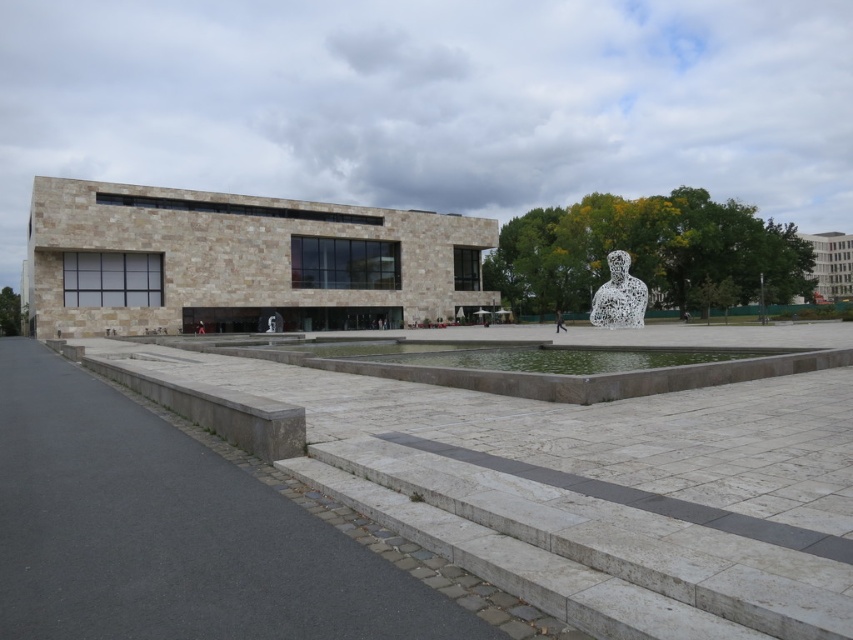
Does beige stone plaza at center appear under speckled stone bust at center-right?

Actually, beige stone plaza at center is above speckled stone bust at center-right.

Which of these two, beige stone plaza at center or speckled stone bust at center-right, stands taller?

beige stone plaza at center

Is point (166, 304) behind point (610, 269)?

Yes, it is.

Locate an element on the screen. The height and width of the screenshot is (640, 853). beige stone plaza at center is located at coordinates (241, 260).

Between point (653, 385) and point (614, 304), which one is positioned in front?

Point (653, 385)

Is point (683, 380) closer to camera compared to point (621, 250)?

Yes, point (683, 380) is in front of point (621, 250).

Locate an element on the screen. The image size is (853, 640). clear stone water at center is located at coordinates (596, 374).

Locate an element on the screen. This screenshot has height=640, width=853. clear stone water at center is located at coordinates (596, 374).

Does beige stone plaza at center have a smaller size compared to clear stone water at center?

Actually, beige stone plaza at center might be larger than clear stone water at center.

The width and height of the screenshot is (853, 640). In order to click on beige stone plaza at center in this screenshot , I will do `click(241, 260)`.